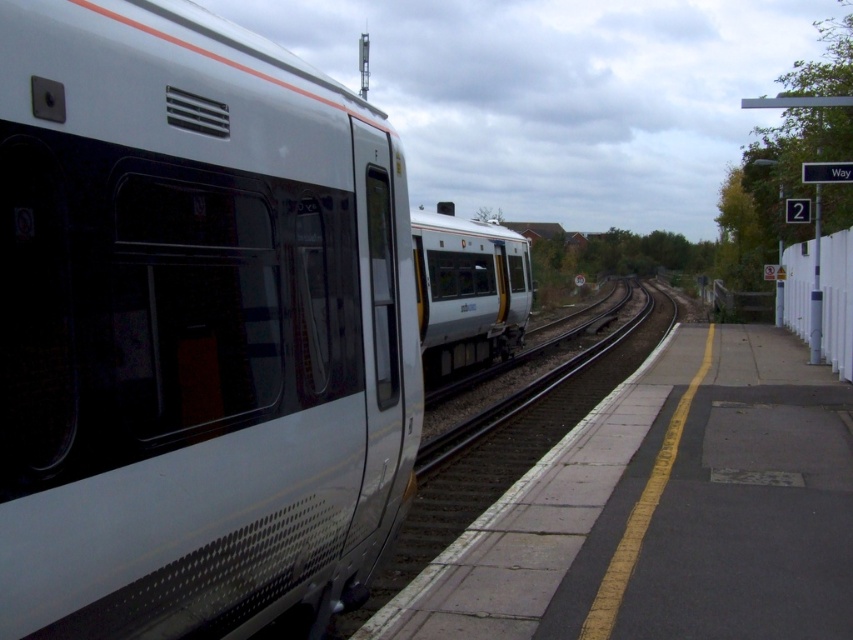
Is point (62, 342) closer to viewer compared to point (593, 404)?

Yes, point (62, 342) is closer to viewer.

Can you confirm if white matte train at left is positioned to the left of smooth metal train track at center?

Correct, you'll find white matte train at left to the left of smooth metal train track at center.

At what (x,y) coordinates should I click in order to perform the action: click on white matte train at left. Please return your answer as a coordinate pair (x, y). This screenshot has width=853, height=640. Looking at the image, I should click on (192, 326).

I want to click on white matte train at left, so click(x=192, y=326).

Which of these two, smooth metal train track at center or white glossy train at center, stands shorter?

With less height is smooth metal train track at center.

Is smooth metal train track at center wider than white glossy train at center?

Correct, the width of smooth metal train track at center exceeds that of white glossy train at center.

Describe the element at coordinates (521, 481) in the screenshot. I see `smooth metal train track at center` at that location.

At what (x,y) coordinates should I click in order to perform the action: click on smooth metal train track at center. Please return your answer as a coordinate pair (x, y). The width and height of the screenshot is (853, 640). Looking at the image, I should click on (521, 481).

Who is more distant from viewer, (x=49, y=22) or (x=439, y=321)?

Point (x=439, y=321)

Does white matte train at left appear on the right side of white glossy train at center?

Incorrect, white matte train at left is not on the right side of white glossy train at center.

Is point (260, 212) more distant than point (496, 260)?

No, it is not.

Where is `white matte train at left`? This screenshot has width=853, height=640. white matte train at left is located at coordinates (192, 326).